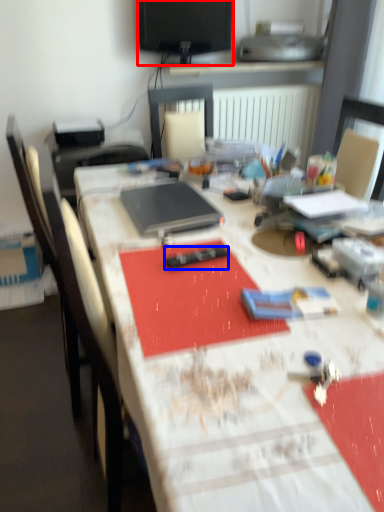
Question: Which object appears farthest to the camera in this image, television (highlighted by a red box) or remote control (highlighted by a blue box)?

Choices:
 (A) television
 (B) remote control

Answer: (A)